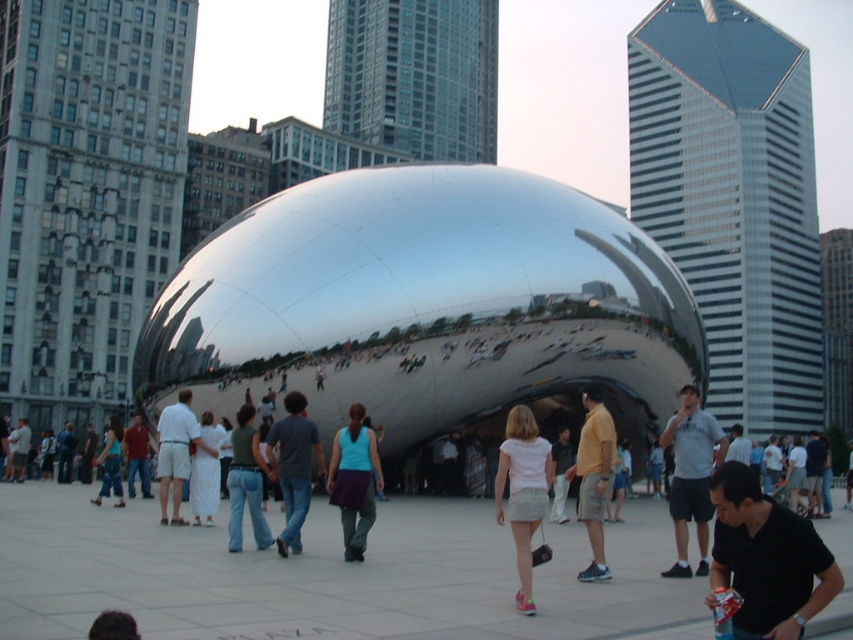
You are a photographer aiming to capture a candid shot of the person wearing a matte gray shirt at center and jeans at center. To ensure both items are fully visible in the frame, which one should you focus on to account for their width?

The matte gray shirt at center might be wider than jeans at center, so focusing on the matte gray shirt at center would ensure both items are fully visible in the frame.

You are standing at the center of Cloud Gate sculpture and looking towards the lower right corner of the image. Which object is located at the point with coordinates (x=766, y=557)?

The point at coordinates (x=766, y=557) is occupied by the black matte shirt at lower right.

You are standing at the base of Cloud Gate in Millennium Park. You notice two points marked on the ground. One is at coordinate point (x=682, y=541) and the other at point (x=268, y=529). If you want to walk towards the point that is closer to you, which coordinate should you head towards?

Point (x=682, y=541) is in front of point (x=268, y=529), so you should head towards point (x=682, y=541) as it is closer to your current position at the base of Cloud Gate.